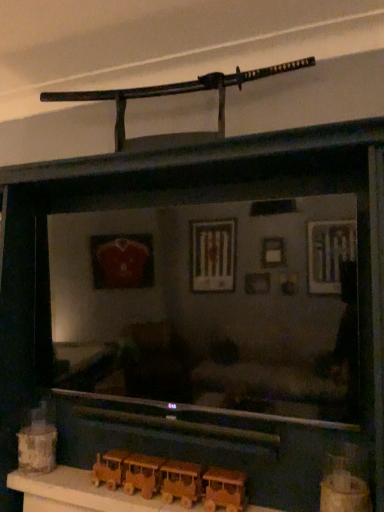
Locate an element on the screen. free space above wooden train at lower center, the 2th toy from the left (from a real-world perspective) is located at coordinates (163, 462).